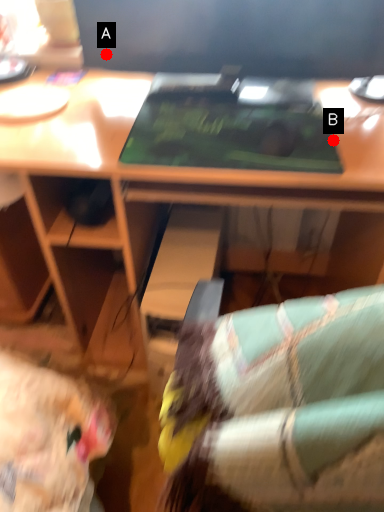
Question: Two points are circled on the image, labeled by A and B beside each circle. Which point is farther to the camera?

Choices:
 (A) A is further
 (B) B is further

Answer: (A)